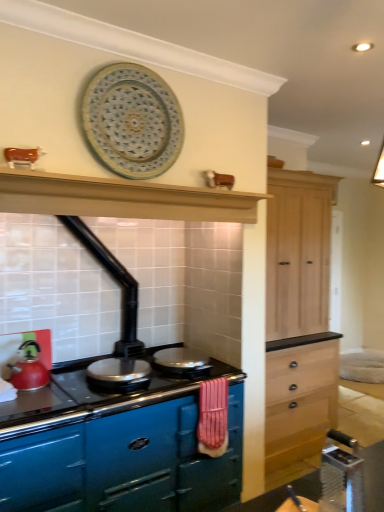
Locate an element on the screen. vacant area situated to the left side of shiny metallic pan at center, the 1th appliance viewed from the left is located at coordinates 70,389.